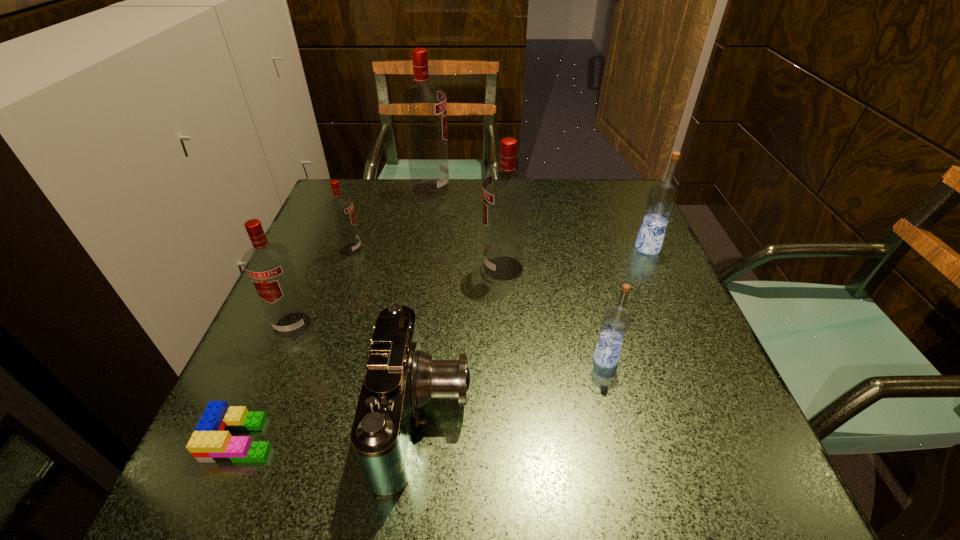
Identify the location of empty space that is in between the seventh object from left to right and the second shortest object. This screenshot has width=960, height=540. (516, 388).

Find the location of a particular element. Image resolution: width=960 pixels, height=540 pixels. vacant area between the smallest red vodka and the fifth farthest vodka is located at coordinates (322, 287).

Find the location of a particular element. The image size is (960, 540). free spot between the second tallest vodka and the farther blue vodka is located at coordinates (575, 258).

Locate an element on the screen. The image size is (960, 540). free space between the rightmost object and the second nearest vodka is located at coordinates (470, 286).

Where is `object that is the third closest one to the green Lego`? This screenshot has height=540, width=960. object that is the third closest one to the green Lego is located at coordinates (340, 208).

The width and height of the screenshot is (960, 540). In order to click on object that stands as the fourth closest to the left blue vodka in this screenshot , I will do `click(211, 441)`.

Select which vodka is the fifth closest to the rightmost red vodka. Please provide its 2D coordinates. Your answer should be formatted as a tuple, i.e. [(x, y)], where the tuple contains the x and y coordinates of a point satisfying the conditions above.

[(268, 265)]

Identify the location of vodka that is the fifth closest to the camcorder. This screenshot has height=540, width=960. (662, 199).

At what (x,y) coordinates should I click in order to perform the action: click on the second closest red vodka to the second tallest vodka. Please return your answer as a coordinate pair (x, y). The image size is (960, 540). Looking at the image, I should click on (340, 208).

Locate an element on the screen. This screenshot has height=540, width=960. red vodka object that ranks as the third closest to the camcorder is located at coordinates (340, 208).